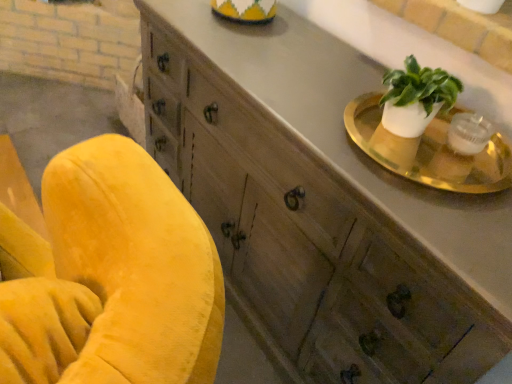
Question: Is wooden cabinet at upper right not close to gold metallic tray at upper right?

Choices:
 (A) no
 (B) yes

Answer: (A)

Question: Considering the relative sizes of wooden cabinet at upper right and gold metallic tray at upper right in the image provided, is wooden cabinet at upper right wider than gold metallic tray at upper right?

Choices:
 (A) yes
 (B) no

Answer: (A)

Question: Is wooden cabinet at upper right at the left side of gold metallic tray at upper right?

Choices:
 (A) no
 (B) yes

Answer: (B)

Question: Can you confirm if wooden cabinet at upper right is shorter than gold metallic tray at upper right?

Choices:
 (A) no
 (B) yes

Answer: (A)

Question: Is wooden cabinet at upper right located outside gold metallic tray at upper right?

Choices:
 (A) no
 (B) yes

Answer: (B)

Question: From the image's perspective, is wooden cabinet at upper right under gold metallic tray at upper right?

Choices:
 (A) no
 (B) yes

Answer: (B)

Question: Is gold metallic tray at upper right bigger than wooden cabinet at upper right?

Choices:
 (A) no
 (B) yes

Answer: (A)

Question: Would you say wooden cabinet at upper right is part of gold metallic tray at upper right's contents?

Choices:
 (A) no
 (B) yes

Answer: (A)

Question: Is gold metallic tray at upper right directly adjacent to wooden cabinet at upper right?

Choices:
 (A) yes
 (B) no

Answer: (B)

Question: Is gold metallic tray at upper right not within wooden cabinet at upper right?

Choices:
 (A) yes
 (B) no

Answer: (B)

Question: Is gold metallic tray at upper right shorter than wooden cabinet at upper right?

Choices:
 (A) no
 (B) yes

Answer: (B)

Question: Are gold metallic tray at upper right and wooden cabinet at upper right located far from each other?

Choices:
 (A) yes
 (B) no

Answer: (B)

Question: Relative to wooden cabinet at upper right, is gold metallic tray at upper right in front or behind?

Choices:
 (A) front
 (B) behind

Answer: (B)